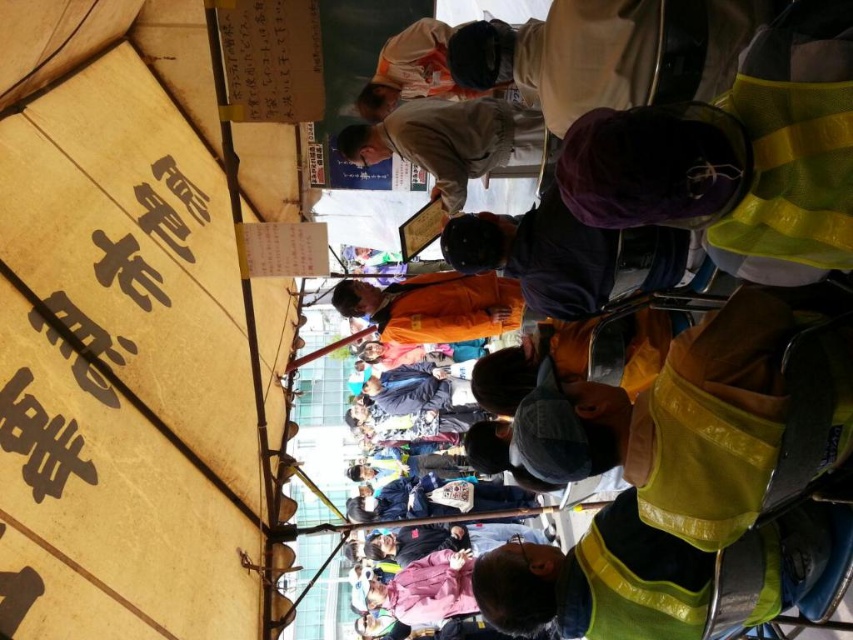
Is yellow canvas canopy at upper left closer to camera compared to orange reflective vest at center?

Yes, yellow canvas canopy at upper left is in front of orange reflective vest at center.

Does yellow canvas canopy at upper left appear over orange reflective vest at center?

Correct, yellow canvas canopy at upper left is located above orange reflective vest at center.

At what (x,y) coordinates should I click in order to perform the action: click on yellow canvas canopy at upper left. Please return your answer as a coordinate pair (x, y). Looking at the image, I should click on (144, 252).

Between orange reflective vest at center and orange fabric at center, which one is positioned lower?

orange fabric at center

Does orange reflective vest at center appear on the left side of orange fabric at center?

Incorrect, orange reflective vest at center is not on the left side of orange fabric at center.

Is point (747, 92) more distant than point (415, 285)?

No.

Locate an element on the screen. orange reflective vest at center is located at coordinates (x=737, y=154).

Can you confirm if yellow canvas canopy at upper left is positioned to the left of brown paper sign at left?

In fact, yellow canvas canopy at upper left is to the right of brown paper sign at left.

In the scene shown: Is yellow canvas canopy at upper left further to camera compared to brown paper sign at left?

That is False.

Is point (270, 339) in front of point (227, 444)?

That is False.

Where is `yellow canvas canopy at upper left`? This screenshot has height=640, width=853. yellow canvas canopy at upper left is located at coordinates (144, 252).